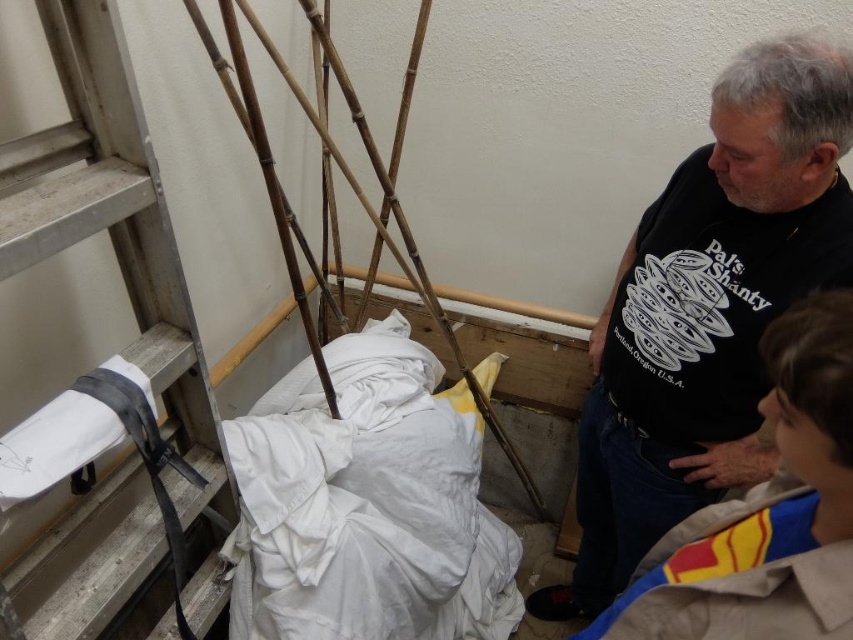
Question: Which of the following is the farthest from the observer?

Choices:
 (A) white cotton cloth at center
 (B) white plastic ladder at left

Answer: (A)

Question: Among these objects, which one is farthest from the camera?

Choices:
 (A) bamboo at left
 (B) light brown fabric jacket at lower right

Answer: (A)

Question: Is white cotton cloth at center to the left of white plastic ladder at left from the viewer's perspective?

Choices:
 (A) yes
 (B) no

Answer: (B)

Question: In this image, where is white cotton cloth at center located relative to light brown fabric jacket at lower right?

Choices:
 (A) left
 (B) right

Answer: (A)

Question: Estimate the real-world distances between objects in this image. Which object is farther from the white cotton cloth at center?

Choices:
 (A) white plastic ladder at left
 (B) black t-shirt at upper right
 (C) bamboo at left

Answer: (B)

Question: Does black t-shirt at upper right have a greater width compared to light brown fabric jacket at lower right?

Choices:
 (A) no
 (B) yes

Answer: (B)